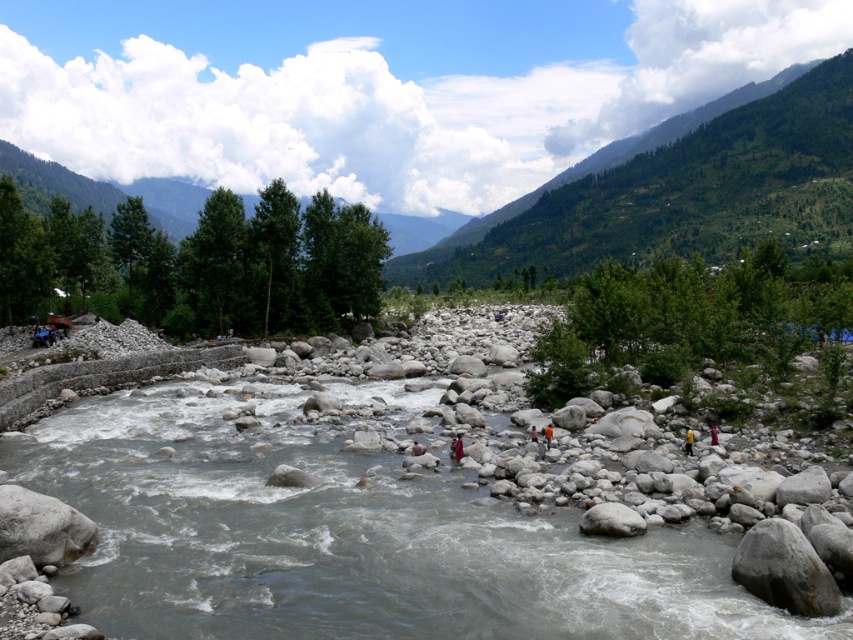
You are standing at point A and want to reach point B. The coordinates of point A are given as point A at (460, 445). The distance between point A and point B is 26.21 meters. Can you walk directly from point A to point B without crossing the river?

The distance between point A at (460, 445) and point B is 26.21 meters. However, the scene description mentions a river flowing through the rocky valley with rapids and eddies over large stones. Since the river is in the foreground and dominates the area, it is likely that the path between the two points crosses the river. Without additional information about a bridge or a path around, it is uncertain if you can walk directly without crossing the river.

You are standing at the point marked by the coordinate point at [682,192]. What is the direction of the green leafy mountain relative to your position?

The point at [682,192] marks the green leafy mountain at upper right, so you are standing directly at the location of the mountain. Therefore, the mountain is at your current position.

You are standing at the edge of the river in the mountain valley and want to reach the point marked as point (460, 454) and point (688, 440). Which point is closer to you?

Point (460, 454) is closer to you because it is further to the viewer than point (688, 440).